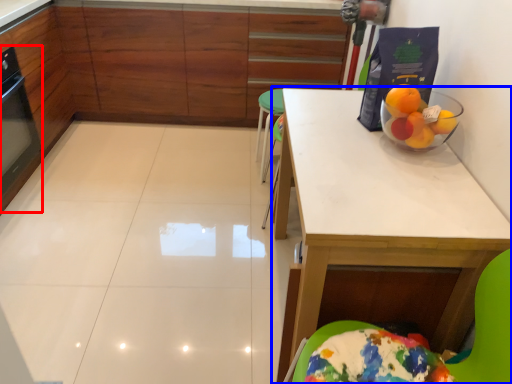
Question: Which object appears farthest to the camera in this image, appliance (highlighted by a red box) or table (highlighted by a blue box)?

Choices:
 (A) appliance
 (B) table

Answer: (A)